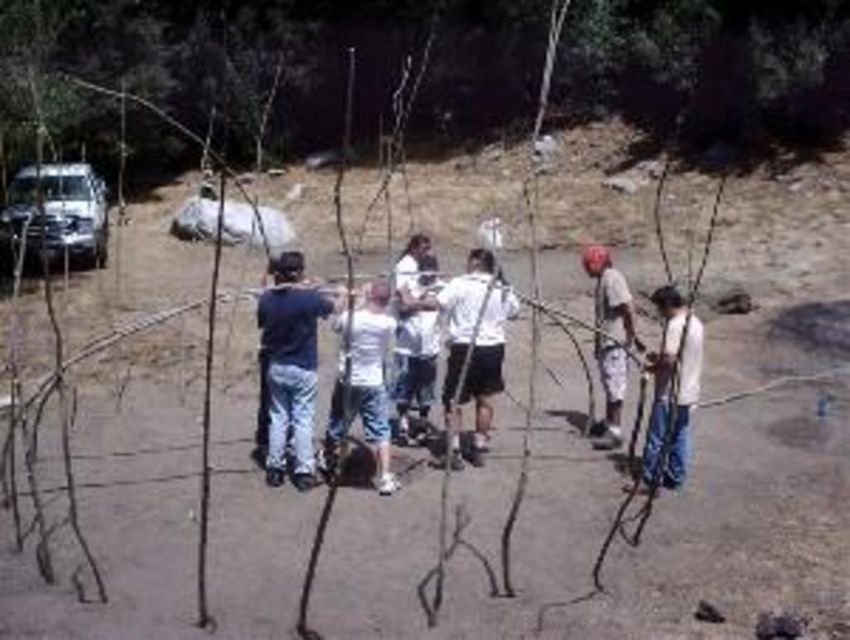
You are standing at the origin point of the coordinate system in the image. You need to deliver a package to the white matte shirt at center. Which direction should you move to reach it?

The white matte shirt at center is located at point (474, 348) in the coordinate system, so you should move towards the center of the image to reach it.

Based on the photo, you are organizing a group activity and need to ensure participants have enough space. You notice two participants wearing a white matte shirt at center and a white cotton shirt at right. Which participant is wearing a shirt with a wider width?

The white matte shirt at center has a larger width than the white cotton shirt at right, so the participant wearing the white matte shirt at center has a wider shirt.

You are standing at the point closer to the front of the structure formed by the poles and ropes. Which point, point (450, 330) or point (363, 292), is farther away from you?

Point (450, 330) is farther away because it is behind point (363, 292), which is closer to you.